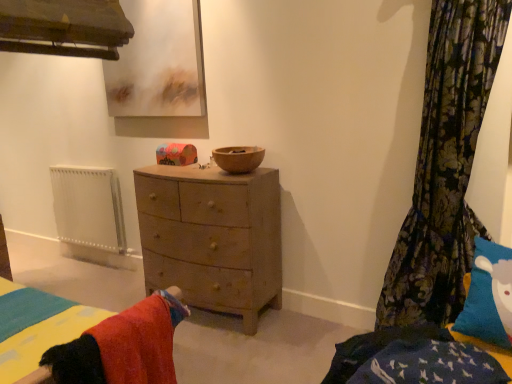
What is the approximate height of wooden chest of drawers at center?

wooden chest of drawers at center is 38.85 inches tall.

Where is `soft cotton bed at center`? soft cotton bed at center is located at coordinates (119, 347).

What do you see at coordinates (89, 207) in the screenshot? I see `white metallic radiator at left` at bounding box center [89, 207].

Image resolution: width=512 pixels, height=384 pixels. Identify the location of floral fabric curtain at right. (445, 166).

Image resolution: width=512 pixels, height=384 pixels. What do you see at coordinates (445, 166) in the screenshot? I see `floral fabric curtain at right` at bounding box center [445, 166].

Identify the location of matte wooden picture frame at upper center. (158, 62).

What do you see at coordinates (158, 62) in the screenshot? I see `matte wooden picture frame at upper center` at bounding box center [158, 62].

Where is `wooden chest of drawers at center`? wooden chest of drawers at center is located at coordinates (212, 237).

From a real-world perspective, is white metallic radiator at left positioned under wooden bowl at center based on gravity?

Yes, from a real-world perspective, white metallic radiator at left is under wooden bowl at center.

Are white metallic radiator at left and wooden bowl at center far apart?

Absolutely, white metallic radiator at left is distant from wooden bowl at center.

Is white metallic radiator at left in front of wooden bowl at center?

No, it is not.

From a real-world perspective, who is located higher, floral fabric curtain at right or wooden chest of drawers at center?

In real-world perspective, floral fabric curtain at right is above.

Who is smaller, floral fabric curtain at right or wooden chest of drawers at center?

Smaller between the two is floral fabric curtain at right.

The height and width of the screenshot is (384, 512). Identify the location of nightstand on the left of floral fabric curtain at right. (212, 237).

Considering the positions of point (444, 69) and point (172, 277), is point (444, 69) closer or farther from the camera than point (172, 277)?

Point (444, 69) is closer to the camera than point (172, 277).

From the image's perspective, between matte wooden picture frame at upper center and white metallic radiator at left, which one is located above?

matte wooden picture frame at upper center, from the image's perspective.

Considering the sizes of objects matte wooden picture frame at upper center and white metallic radiator at left in the image provided, who is wider, matte wooden picture frame at upper center or white metallic radiator at left?

Wider between the two is white metallic radiator at left.

Consider the image. Are matte wooden picture frame at upper center and white metallic radiator at left located far from each other?

No, there isn't a large distance between matte wooden picture frame at upper center and white metallic radiator at left.

Is wooden chest of drawers at center directly adjacent to matte wooden picture frame at upper center?

wooden chest of drawers at center and matte wooden picture frame at upper center are clearly separated.

Could you tell me if wooden chest of drawers at center is turned towards matte wooden picture frame at upper center?

No, wooden chest of drawers at center is not oriented towards matte wooden picture frame at upper center.

Considering the relative sizes of wooden chest of drawers at center and matte wooden picture frame at upper center in the image provided, is wooden chest of drawers at center taller than matte wooden picture frame at upper center?

Indeed, wooden chest of drawers at center has a greater height compared to matte wooden picture frame at upper center.

Measure the distance from matte wooden picture frame at upper center to soft cotton bed at center.

They are 1.96 meters apart.

Looking at this image, from a real-world perspective, is matte wooden picture frame at upper center below soft cotton bed at center?

Incorrect, from a real-world perspective, matte wooden picture frame at upper center is higher than soft cotton bed at center.

Is there a large distance between matte wooden picture frame at upper center and soft cotton bed at center?

That's right, there is a large distance between matte wooden picture frame at upper center and soft cotton bed at center.

Find the location of a particular element. Image resolution: width=512 pixels, height=384 pixels. picture frame that appears above the soft cotton bed at center (from the image's perspective) is located at coordinates (158, 62).

Which of these two, matte wooden picture frame at upper center or wooden bowl at center, is smaller?

Smaller between the two is wooden bowl at center.

Based on the photo, how much distance is there between matte wooden picture frame at upper center and wooden bowl at center?

35.14 inches.

Is matte wooden picture frame at upper center far away from wooden bowl at center?

No.

From the image's perspective, is matte wooden picture frame at upper center over wooden bowl at center?

Yes, from the image's perspective, matte wooden picture frame at upper center is on top of wooden bowl at center.

From a real-world perspective, relative to matte wooden picture frame at upper center, is soft cotton bed at center vertically above or below?

In terms of real-world spatial position, soft cotton bed at center is below matte wooden picture frame at upper center.

How distant is soft cotton bed at center from matte wooden picture frame at upper center?

soft cotton bed at center is 6.44 feet from matte wooden picture frame at upper center.

Considering the positions of objects soft cotton bed at center and matte wooden picture frame at upper center in the image provided, who is more to the left, soft cotton bed at center or matte wooden picture frame at upper center?

matte wooden picture frame at upper center.

Which of these two, soft cotton bed at center or matte wooden picture frame at upper center, is thinner?

With smaller width is matte wooden picture frame at upper center.

Where is `bowl in front of the white metallic radiator at left`? This screenshot has height=384, width=512. bowl in front of the white metallic radiator at left is located at coordinates click(x=238, y=158).

In the image, there is a wooden chest of drawers at center. In order to click on curtain above it (from the image's perspective) in this screenshot , I will do `click(445, 166)`.

From the image, which object appears to be nearer to wooden bowl at center, wooden chest of drawers at center or white metallic radiator at left?

wooden chest of drawers at center.

Considering their positions, is white metallic radiator at left positioned closer to soft cotton bed at center than floral fabric curtain at right?

Based on the image, floral fabric curtain at right appears to be nearer to soft cotton bed at center.

From the image, which object appears to be farther from floral fabric curtain at right, wooden chest of drawers at center or wooden bowl at center?

The object further to floral fabric curtain at right is wooden chest of drawers at center.

From the picture: From the image, which object appears to be farther from wooden chest of drawers at center, white metallic radiator at left or matte wooden picture frame at upper center?

Among the two, white metallic radiator at left is located further to wooden chest of drawers at center.

Based on their spatial positions, is white metallic radiator at left or soft cotton bed at center closer to wooden chest of drawers at center?

Based on the image, soft cotton bed at center appears to be nearer to wooden chest of drawers at center.

When comparing their distances from soft cotton bed at center, does floral fabric curtain at right or white metallic radiator at left seem further?

white metallic radiator at left is further to soft cotton bed at center.

Looking at the image, which one is located closer to matte wooden picture frame at upper center, wooden chest of drawers at center or floral fabric curtain at right?

wooden chest of drawers at center is closer to matte wooden picture frame at upper center.

Estimate the real-world distances between objects in this image. Which object is further from white metallic radiator at left, soft cotton bed at center or matte wooden picture frame at upper center?

Based on the image, soft cotton bed at center appears to be further to white metallic radiator at left.

Identify the location of bowl between matte wooden picture frame at upper center and wooden chest of drawers at center from top to bottom. (238, 158).

The width and height of the screenshot is (512, 384). I want to click on picture frame situated between white metallic radiator at left and floral fabric curtain at right from left to right, so click(158, 62).

The image size is (512, 384). I want to click on nightstand positioned between soft cotton bed at center and matte wooden picture frame at upper center from near to far, so click(212, 237).

Identify the location of bowl positioned between soft cotton bed at center and matte wooden picture frame at upper center from near to far. (238, 158).